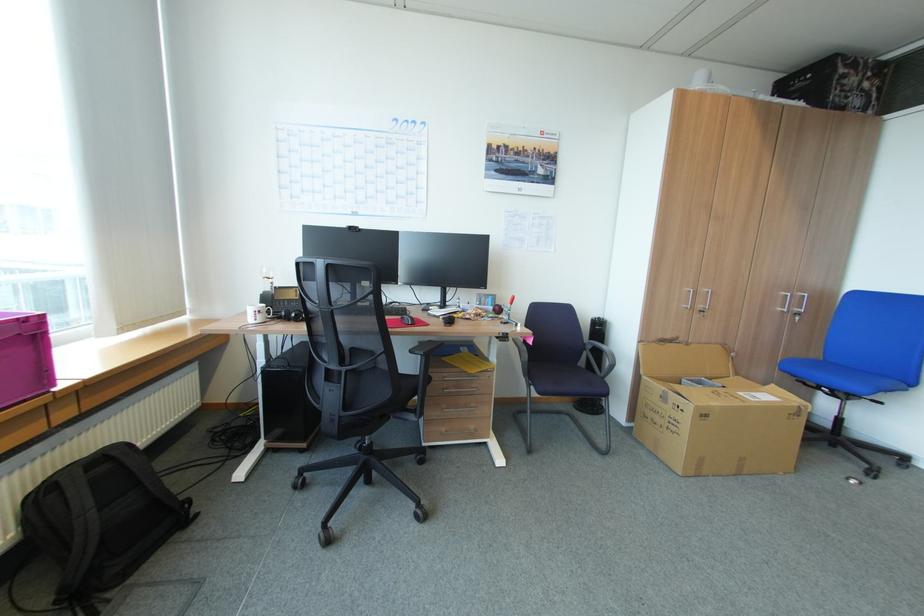
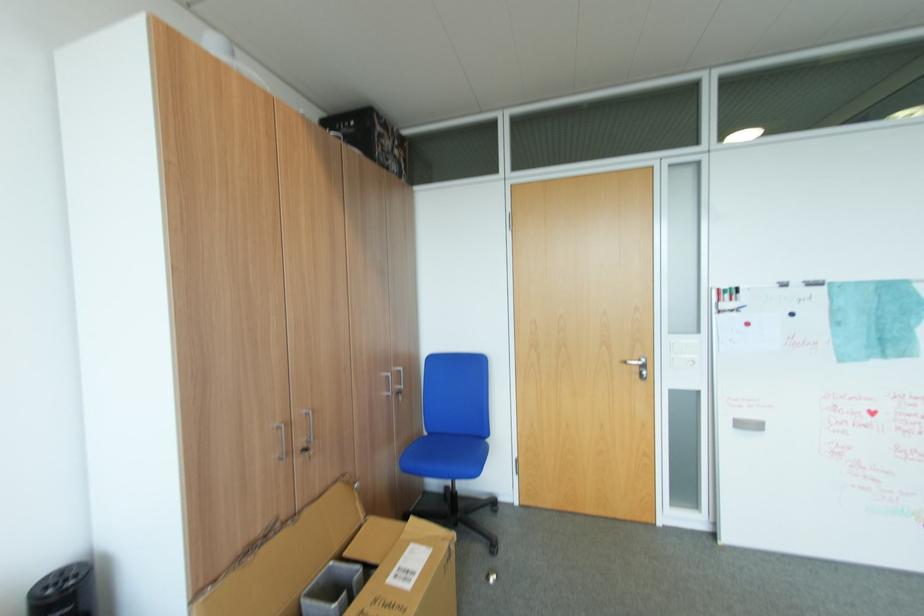
Where in the second image is the point corresponding to (x=791, y=310) from the first image?

(394, 394)